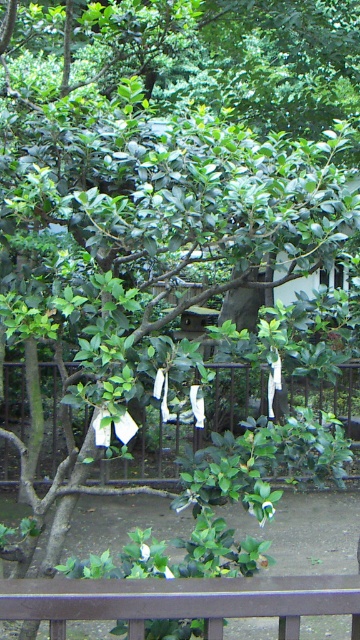
Question: Which point is closer to the camera?

Choices:
 (A) (251, 369)
 (B) (306, 611)

Answer: (B)

Question: Which point is farther from the camera taking this photo?

Choices:
 (A) (104, 609)
 (B) (155, 474)

Answer: (B)

Question: Does black metal fence at center appear on the left side of metallic gray fence at bottom?

Choices:
 (A) no
 (B) yes

Answer: (A)

Question: Does black metal fence at center appear on the right side of metallic gray fence at bottom?

Choices:
 (A) no
 (B) yes

Answer: (B)

Question: Does black metal fence at center have a larger size compared to metallic gray fence at bottom?

Choices:
 (A) no
 (B) yes

Answer: (B)